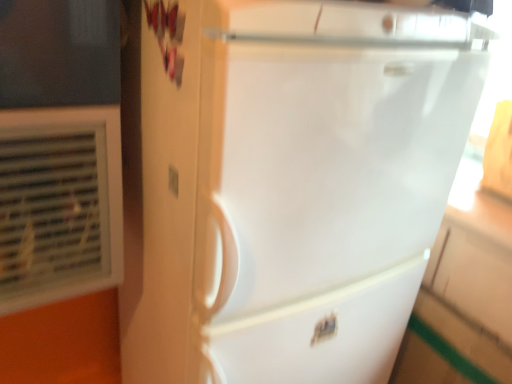
Measure the distance between point (63, 256) and camera.

The distance of point (63, 256) from camera is 30.04 inches.

Find the location of a particular element. This screenshot has width=512, height=384. matte white outlet at center is located at coordinates pos(173,180).

Locate an element on the screen. The height and width of the screenshot is (384, 512). white glossy refrigerator at center is located at coordinates (286, 184).

From a real-world perspective, is white glossy refrigerator at center positioned under white plastic air conditioning unit at left based on gravity?

Yes, from a real-world perspective, white glossy refrigerator at center is beneath white plastic air conditioning unit at left.

In the scene shown: Would you say white plastic air conditioning unit at left is part of white glossy refrigerator at center's contents?

No.

In the image, is white glossy refrigerator at center on the left side or the right side of white plastic air conditioning unit at left?

white glossy refrigerator at center is positioned on white plastic air conditioning unit at left's right side.

From the image's perspective, would you say white glossy refrigerator at center is positioned over white plastic air conditioning unit at left?

Incorrect, from the image's perspective, white glossy refrigerator at center is lower than white plastic air conditioning unit at left.

Is matte white outlet at center oriented towards white glossy refrigerator at center?

Yes, matte white outlet at center is facing white glossy refrigerator at center.

Is matte white outlet at center bigger or smaller than white glossy refrigerator at center?

Considering their sizes, matte white outlet at center takes up less space than white glossy refrigerator at center.

Between matte white outlet at center and white glossy refrigerator at center, which one has larger width?

white glossy refrigerator at center.

This screenshot has height=384, width=512. In order to click on air conditioning on the left of matte white outlet at center in this screenshot , I will do `click(59, 204)`.

Is white plastic air conditioning unit at left closer to camera compared to matte white outlet at center?

Yes, it is in front of matte white outlet at center.

Is white plastic air conditioning unit at left touching matte white outlet at center?

They are not placed beside each other.

Is white plastic air conditioning unit at left completely or partially outside of matte white outlet at center?

Yes, white plastic air conditioning unit at left is located beyond the bounds of matte white outlet at center.

Is matte white outlet at center beside white plastic air conditioning unit at left?

No, matte white outlet at center is not with white plastic air conditioning unit at left.

Is matte white outlet at center not within white plastic air conditioning unit at left?

matte white outlet at center is positioned outside white plastic air conditioning unit at left.

Could you tell me if matte white outlet at center is facing white plastic air conditioning unit at left?

No, matte white outlet at center is not aimed at white plastic air conditioning unit at left.

Considering the sizes of objects matte white outlet at center and white plastic air conditioning unit at left in the image provided, who is smaller, matte white outlet at center or white plastic air conditioning unit at left?

Smaller between the two is matte white outlet at center.

From a real-world perspective, is white glossy refrigerator at center physically located above or below matte white outlet at center?

From a real-world perspective, white glossy refrigerator at center is physically below matte white outlet at center.

Looking at this image, which is closer, (264, 289) or (176, 192)?

Point (176, 192)

Is white glossy refrigerator at center shorter than matte white outlet at center?

No.

Is white glossy refrigerator at center positioned with its back to matte white outlet at center?

No, white glossy refrigerator at center is not facing the opposite direction of matte white outlet at center.

Can you confirm if white plastic air conditioning unit at left is smaller than white glossy refrigerator at center?

Yes, white plastic air conditioning unit at left is smaller than white glossy refrigerator at center.

Is white plastic air conditioning unit at left aimed at white glossy refrigerator at center?

No, white plastic air conditioning unit at left does not turn towards white glossy refrigerator at center.

Can white glossy refrigerator at center be found inside white plastic air conditioning unit at left?

Actually, white glossy refrigerator at center is outside white plastic air conditioning unit at left.

Where is `refrigerator in front of the white plastic air conditioning unit at left`? refrigerator in front of the white plastic air conditioning unit at left is located at coordinates (286, 184).

Identify the location of electric outlet behind the white glossy refrigerator at center. This screenshot has width=512, height=384. pos(173,180).

Estimate the real-world distances between objects in this image. Which object is further from matte white outlet at center, white glossy refrigerator at center or white plastic air conditioning unit at left?

white glossy refrigerator at center is positioned further to the anchor matte white outlet at center.

Consider the image. Which object lies further to the anchor point matte white outlet at center, white plastic air conditioning unit at left or white glossy refrigerator at center?

Among the two, white glossy refrigerator at center is located further to matte white outlet at center.

Estimate the real-world distances between objects in this image. Which object is closer to white plastic air conditioning unit at left, white glossy refrigerator at center or matte white outlet at center?

The object closer to white plastic air conditioning unit at left is matte white outlet at center.

From the image, which object appears to be farther from white glossy refrigerator at center, white plastic air conditioning unit at left or matte white outlet at center?

Based on the image, matte white outlet at center appears to be further to white glossy refrigerator at center.

Which object lies further to the anchor point white plastic air conditioning unit at left, matte white outlet at center or white glossy refrigerator at center?

Based on the image, white glossy refrigerator at center appears to be further to white plastic air conditioning unit at left.

When comparing their distances from white glossy refrigerator at center, does matte white outlet at center or white plastic air conditioning unit at left seem further?

matte white outlet at center is further to white glossy refrigerator at center.

What are the coordinates of `electric outlet between white plastic air conditioning unit at left and white glossy refrigerator at center in the horizontal direction` in the screenshot? It's located at (173, 180).